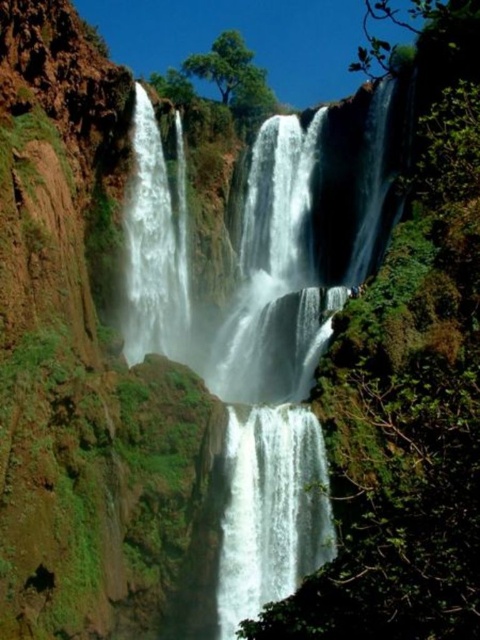
You are standing at the edge of the cliff overlooking the waterfall. You see the white water at center and the white smooth waterfall at center. Which one is located to the left?

The white water at center is positioned on the left side of the white smooth waterfall at center, so the white water at center is located to the left.

You are a hiker who wants to cross the river at the bottom of the cliff. The white smooth waterfall at center is pouring down. There is a large boulder on the opposite side of the waterfall. The distance between you and the boulder is 62.55 meters. Can you safely jump from your current position to the boulder? Explain your reasoning.

The distance between you and the boulder is 62.55 meters. Since the average human jump distance is much shorter than this, jumping 62.55 meters is impossible. Therefore, it is not safe to attempt the jump.

You are a hiker who wants to cross from the white water at center to the white smooth waterfall at left. Given that your hiking boots have a maximum grip capacity of 20 feet, can you safely make the jump? Please explain your reasoning.

The distance between the white water at center and the white smooth waterfall at left is 21.29 feet. Since your hiking boots have a maximum grip capacity of 20 feet, the jump is beyond the safe range. You should not attempt the jump as it exceeds the recommended distance.